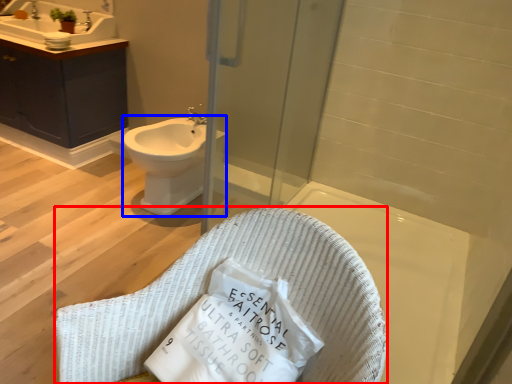
Question: Which point is further to the camera, rocking chair (highlighted by a red box) or bidet (highlighted by a blue box)?

Choices:
 (A) rocking chair
 (B) bidet

Answer: (B)